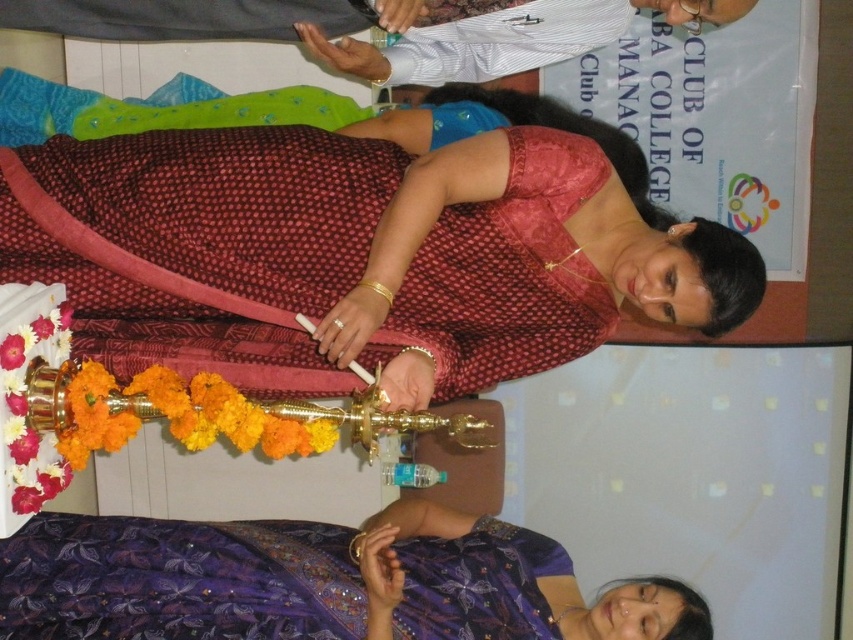
Question: Which object is farther from the camera taking this photo?

Choices:
 (A) purple sequined saree at lower left
 (B) maroon printed saree at center

Answer: (A)

Question: Considering the relative positions of maroon printed saree at center and purple sequined saree at lower left in the image provided, where is maroon printed saree at center located with respect to purple sequined saree at lower left?

Choices:
 (A) right
 (B) left

Answer: (A)

Question: Does maroon printed saree at center appear on the left side of purple sequined saree at lower left?

Choices:
 (A) no
 (B) yes

Answer: (A)

Question: Observing the image, what is the correct spatial positioning of maroon printed saree at center in reference to purple sequined saree at lower left?

Choices:
 (A) left
 (B) right

Answer: (B)